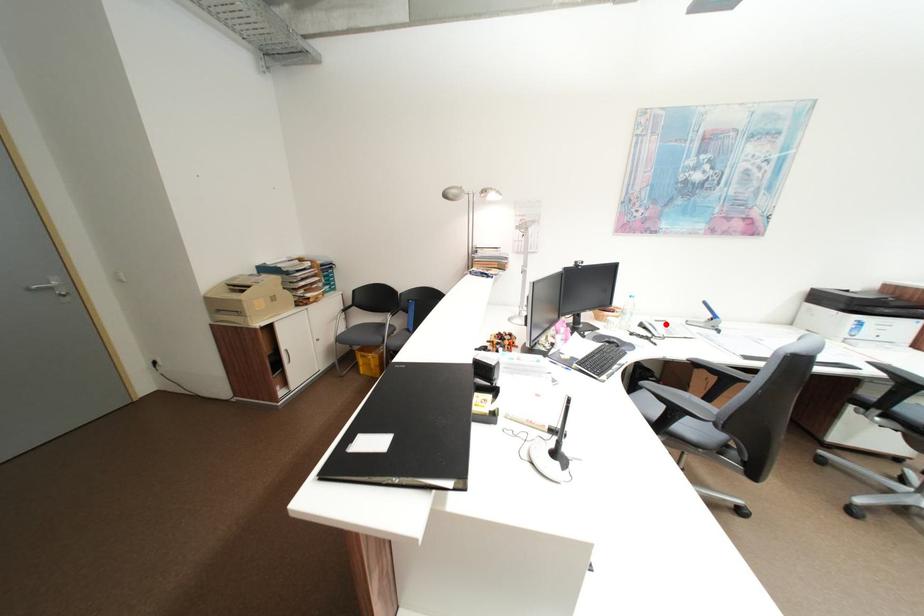
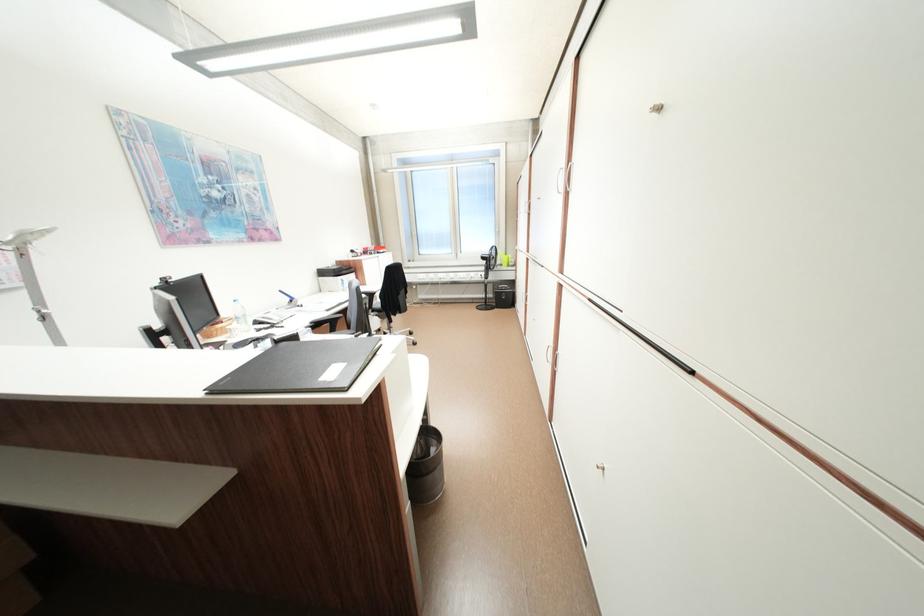
Find the pixel in the second image that matches the highlighted location in the first image.

(275, 317)